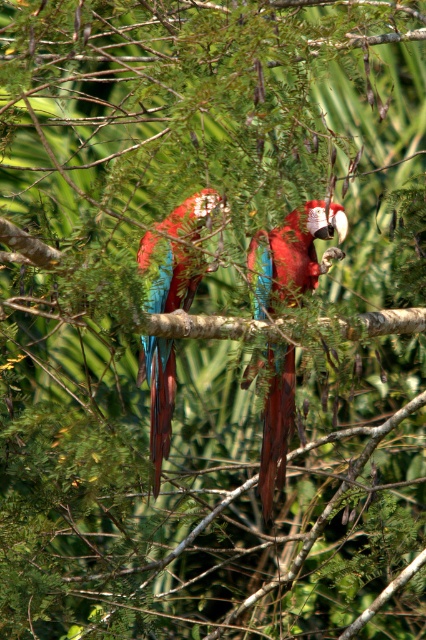
You are a photographer aiming to capture the shiny metallic parrot at center in your shot. The camera is set to focus on the point at coordinates 0.4, 0.69. Will the parrot be in focus?

The shiny metallic parrot at center is located at (x=293, y=253), which is very close to the camera focus point at (x=293, y=256). Therefore, the parrot will be in focus.

You are a birdwatcher observing two parrots in the image. You notice both a shiny metallic parrot at center and a glossy metallic parrot at center. Which one appears closer to you?

The shiny metallic parrot at center appears closer to you because the glossy metallic parrot at center is positioned behind it.